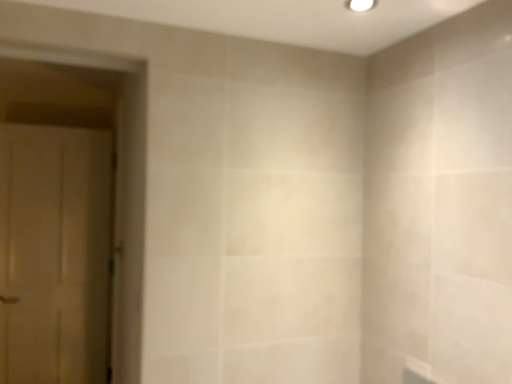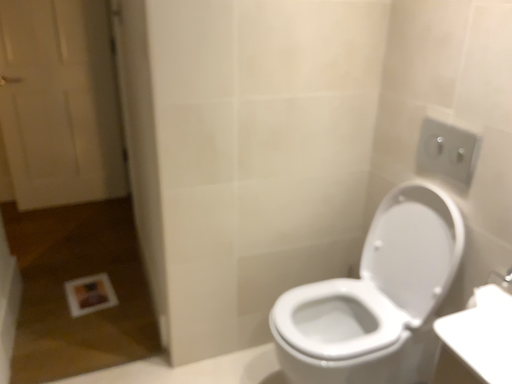
Question: Which way did the camera rotate in the video?

Choices:
 (A) rotated downward
 (B) rotated upward

Answer: (A)